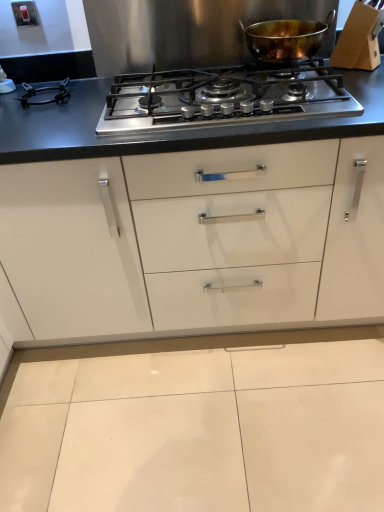
Question: Is stainless steel gas stove at center taller or shorter than shiny copper pot at upper center?

Choices:
 (A) short
 (B) tall

Answer: (A)

Question: Is stainless steel gas stove at center wider or thinner than shiny copper pot at upper center?

Choices:
 (A) thin
 (B) wide

Answer: (B)

Question: From the image's perspective, is stainless steel gas stove at center above or below shiny copper pot at upper center?

Choices:
 (A) above
 (B) below

Answer: (B)

Question: In the image, is shiny copper pot at upper center on the left side or the right side of stainless steel gas stove at center?

Choices:
 (A) right
 (B) left

Answer: (A)

Question: From the image's perspective, is shiny copper pot at upper center located above or below stainless steel gas stove at center?

Choices:
 (A) above
 (B) below

Answer: (A)

Question: Considering the positions of shiny copper pot at upper center and stainless steel gas stove at center in the image, is shiny copper pot at upper center bigger or smaller than stainless steel gas stove at center?

Choices:
 (A) big
 (B) small

Answer: (B)

Question: Is point (274, 59) positioned closer to the camera than point (182, 139)?

Choices:
 (A) farther
 (B) closer

Answer: (A)